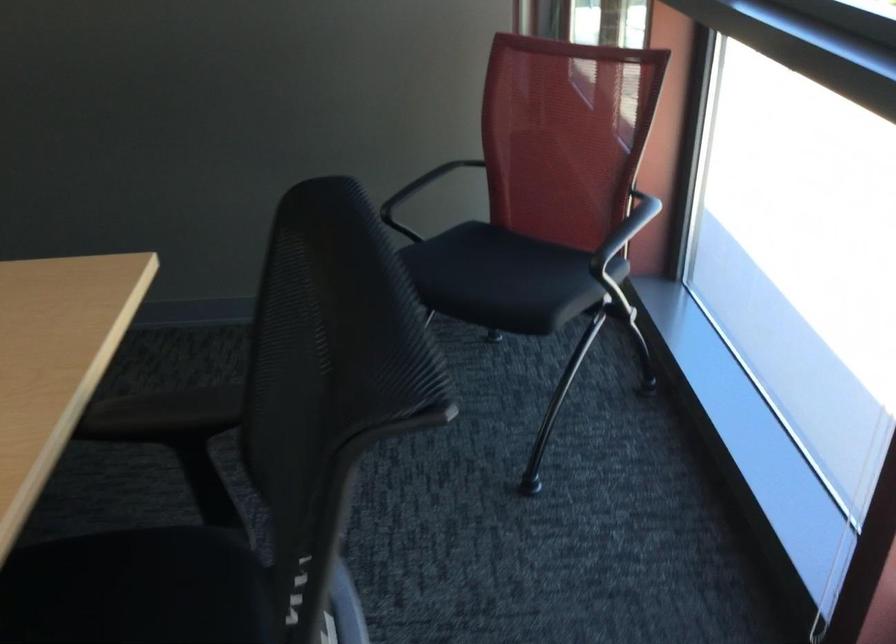
What do you see at coordinates (819, 619) in the screenshot? The width and height of the screenshot is (896, 644). I see `the blind pull cord` at bounding box center [819, 619].